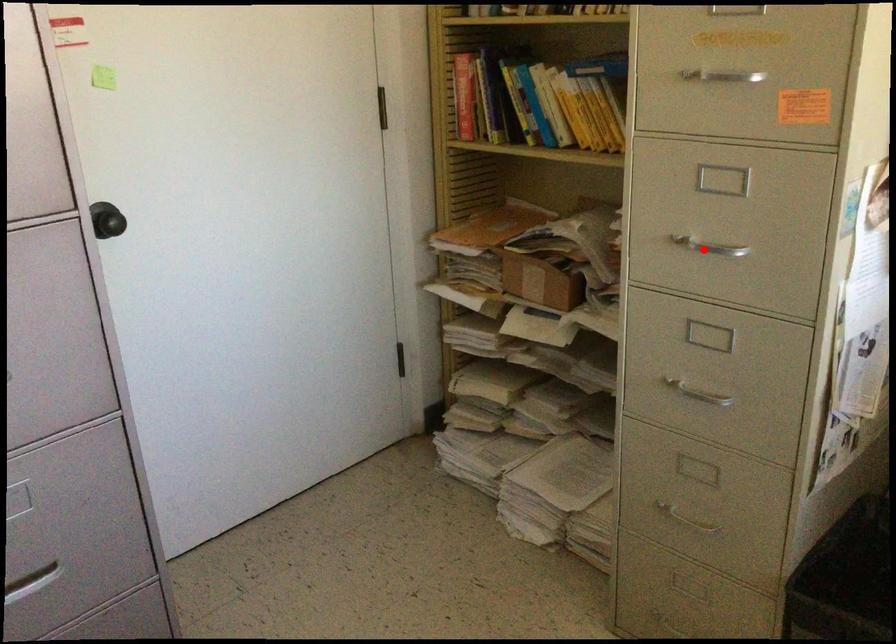
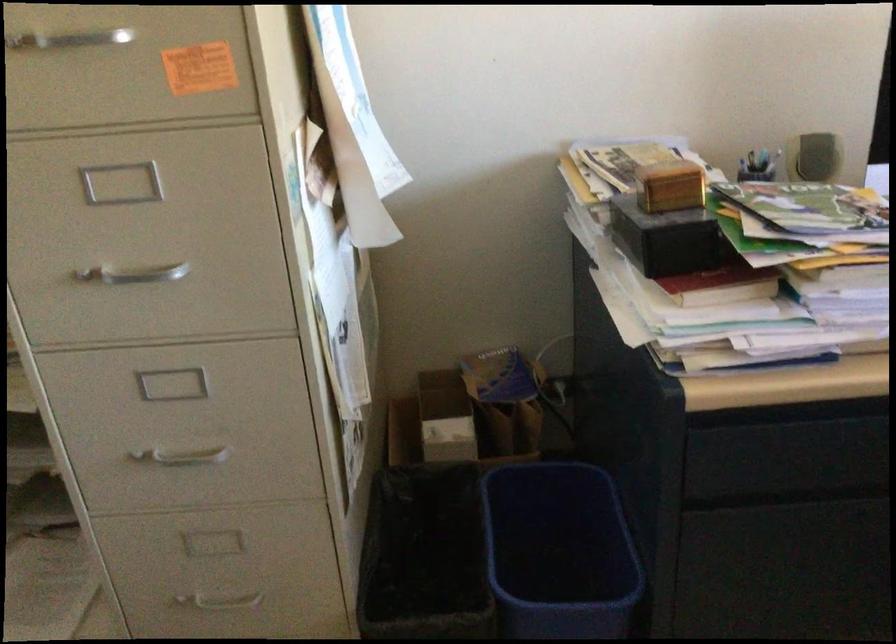
Question: I am providing you with two images of the same scene from different viewpoints. Given a red point in image1, look at the same physical point in image2. Is it:

Choices:
 (A) Closer to the viewpoint
 (B) Farther from the viewpoint

Answer: (A)